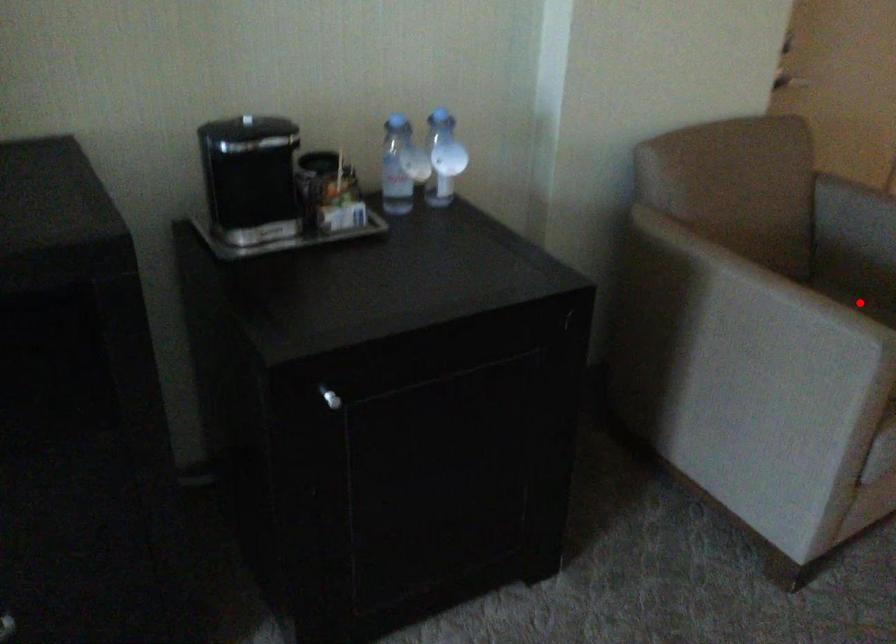
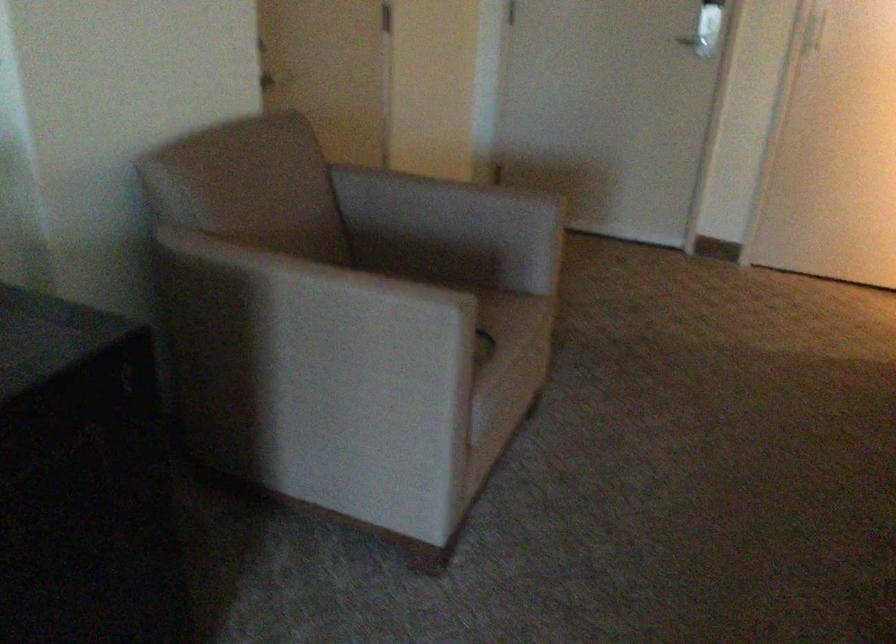
Question: I am providing you with two images of the same scene from different viewpoints. Given a red point in image1, look at the same physical point in image2. Is it:

Choices:
 (A) Closer to the viewpoint
 (B) Farther from the viewpoint

Answer: (A)